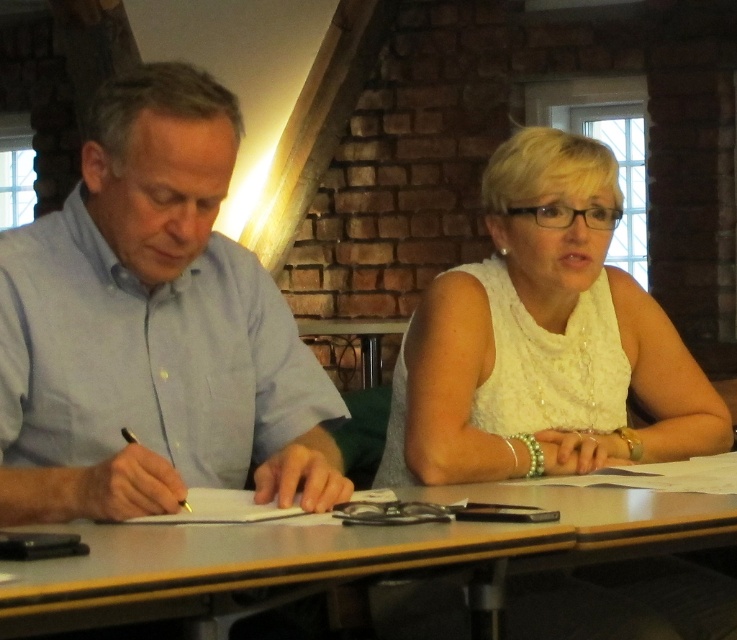
Based on the photo, can you confirm if light blue shirt at left is positioned to the left of smooth wooden table at center?

Indeed, light blue shirt at left is positioned on the left side of smooth wooden table at center.

Between light blue shirt at left and smooth wooden table at center, which one is positioned higher?

Positioned higher is light blue shirt at left.

Is point (7, 236) positioned after point (41, 632)?

Yes.

This screenshot has height=640, width=737. What are the coordinates of `light blue shirt at left` in the screenshot? It's located at (153, 328).

Between point (500, 429) and point (144, 570), which one is positioned behind?

The point (500, 429) is more distant.

Does point (486, 182) come closer to viewer compared to point (467, 538)?

No, it is behind (467, 538).

Locate an element on the screen. This screenshot has width=737, height=640. white lace dress at center is located at coordinates (542, 339).

Which of these two, light blue shirt at left or white lace dress at center, stands shorter?

light blue shirt at left

I want to click on light blue shirt at left, so click(153, 328).

Find the location of a particular element. The image size is (737, 640). light blue shirt at left is located at coordinates (153, 328).